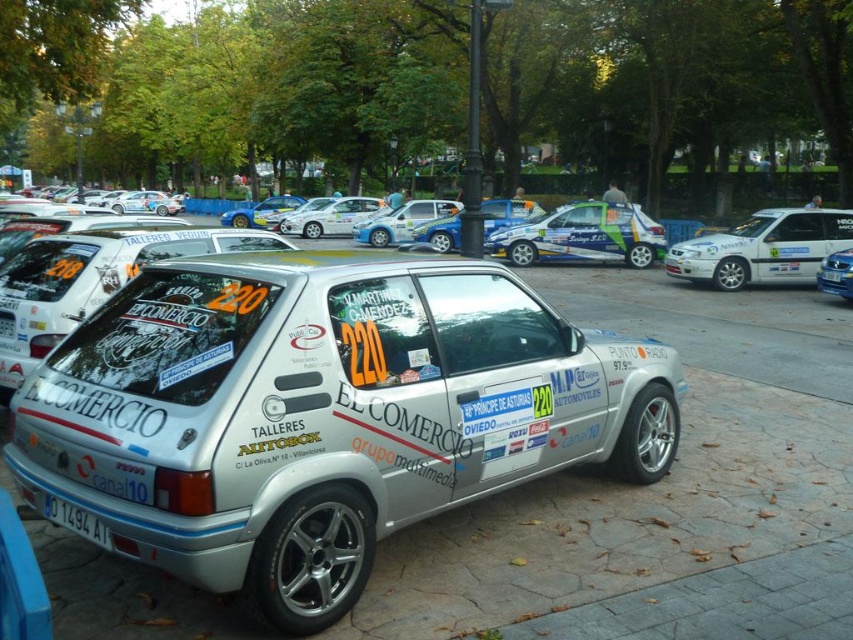
You are a photographer at the rally car gathering. You need to capture a photo of the white metallic car at center and the white plastic license plate at lower left. Which object is wider in the image?

The white metallic car at center is wider than the white plastic license plate at lower left.

You are a photographer at the rally event and need to capture a photo of the white metallic car at center and the white plastic license plate at lower left. The minimum distance between the two objects in the image should be 3 feet to ensure clarity. Can you confirm if the current positioning allows for this requirement?

The white metallic car at center is 3.64 feet from the white plastic license plate at lower left, which exceeds the minimum required distance of 3 feet. Therefore, the current positioning allows for the photo to meet the clarity requirement.